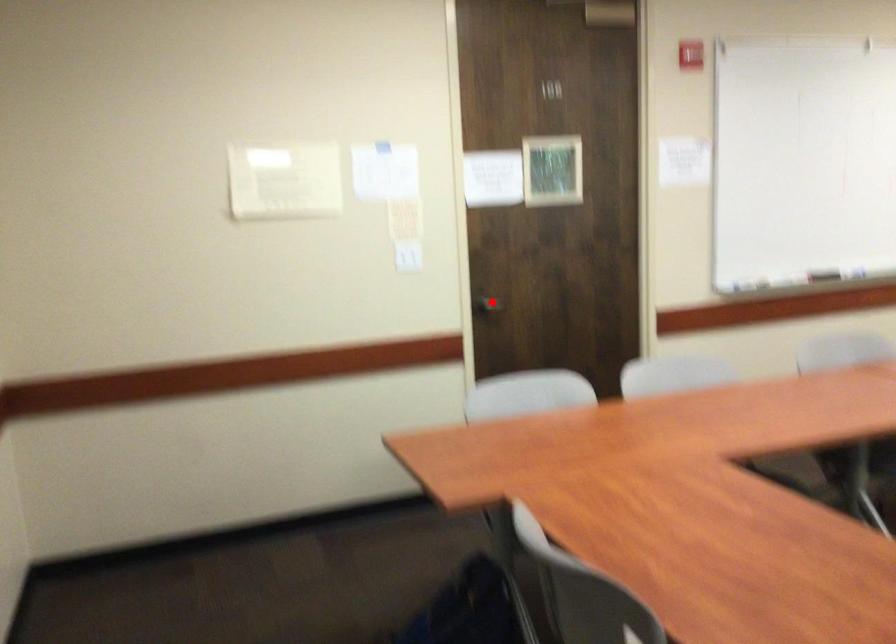
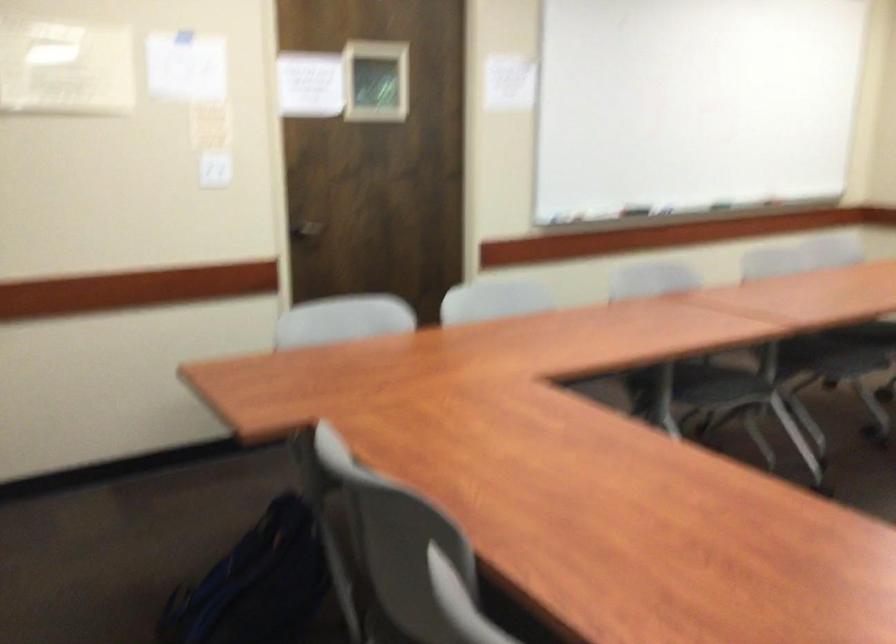
Locate, in the second image, the point that corresponds to the highlighted location in the first image.

(306, 228)